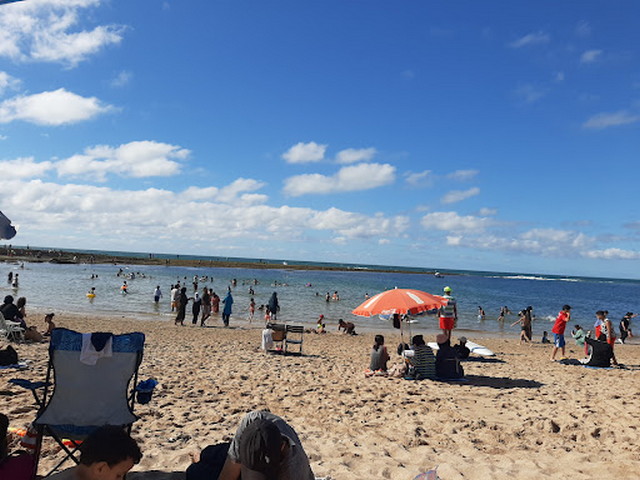
You are a GUI agent. You are given a task and a screenshot of the screen. Output one action in this format:
    pyautogui.click(x=<x>, y=<y>)
    Task: Click on the towel
    The height and width of the screenshot is (480, 640).
    Given the screenshot: What is the action you would take?
    pyautogui.click(x=266, y=339)